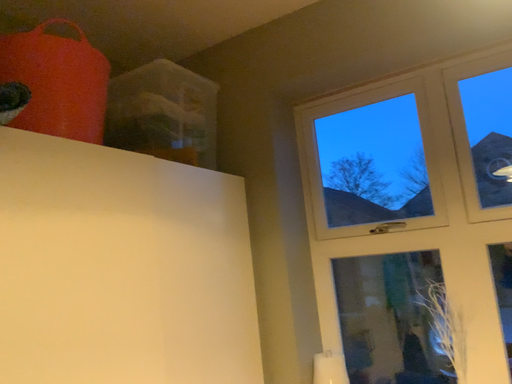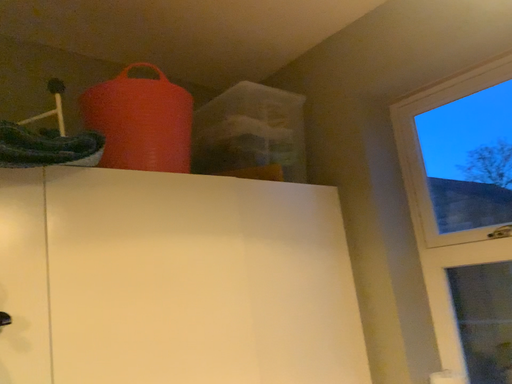
Question: How did the camera likely rotate when shooting the video?

Choices:
 (A) rotated left
 (B) rotated right

Answer: (A)